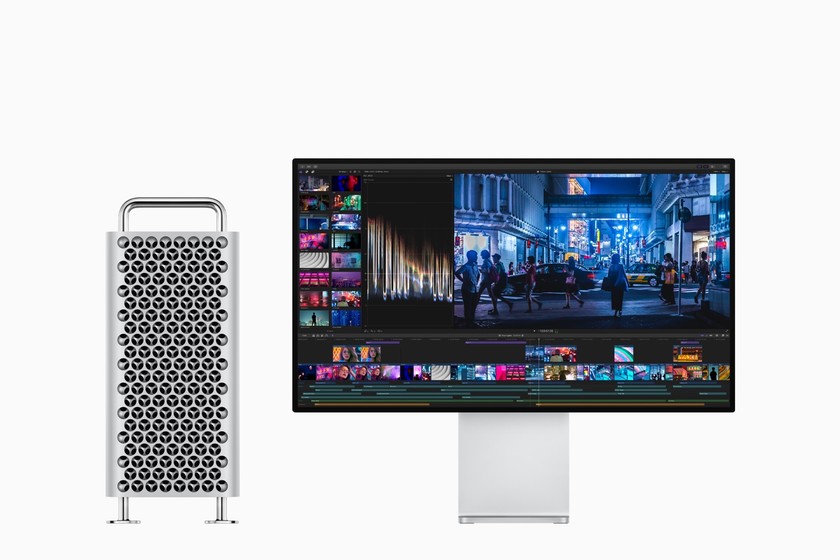
Identify the location of monitor. The image size is (840, 560). (501, 240).